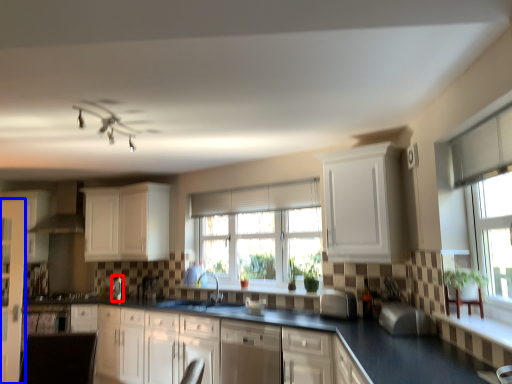
Question: Which of the following is the farthest to the observer, appliance (highlighted by a red box) or screen door (highlighted by a blue box)?

Choices:
 (A) appliance
 (B) screen door

Answer: (A)